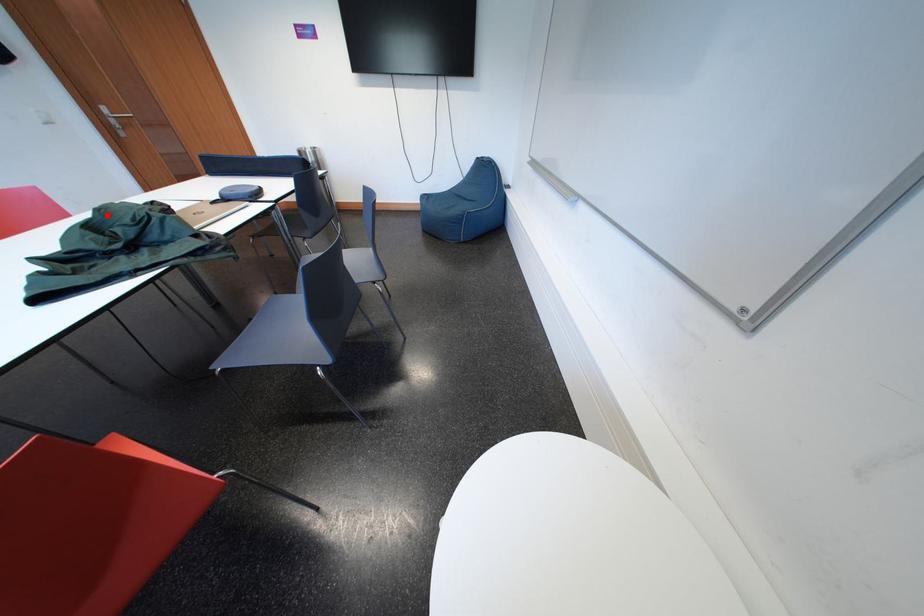
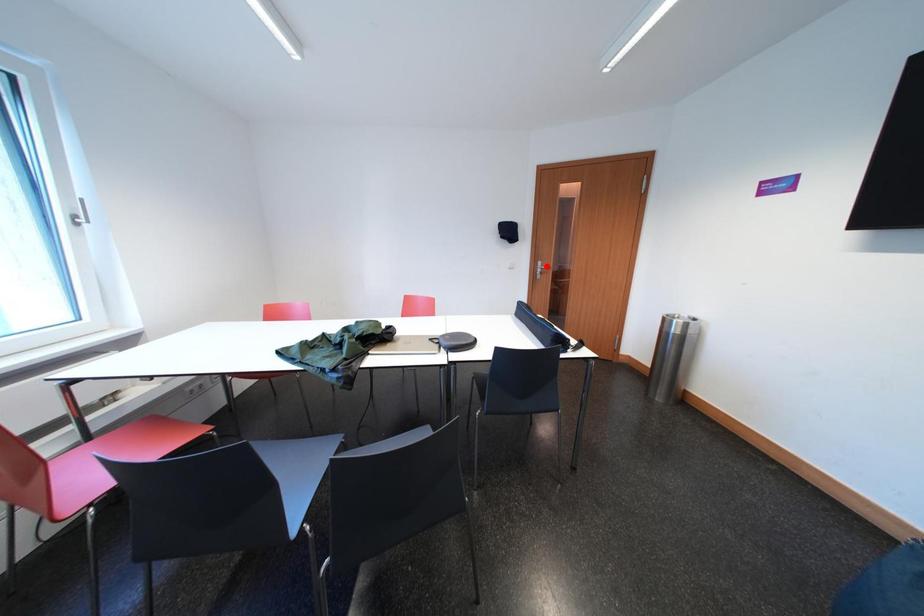
I am providing you with two images of the same scene from different viewpoints. A red point is marked on the first image and another point is marked on the second image. Is the red point in image1 aligned with the point shown in image2?

No